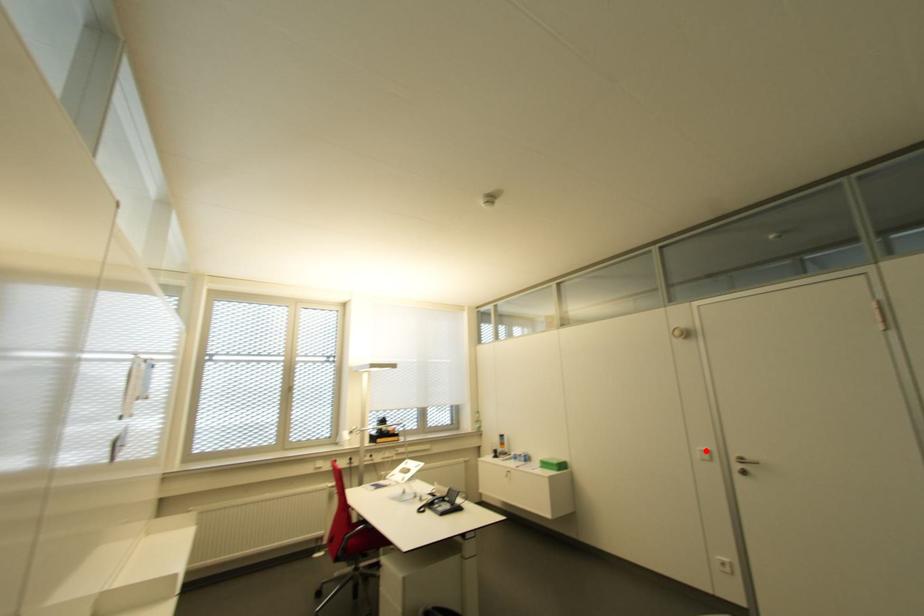
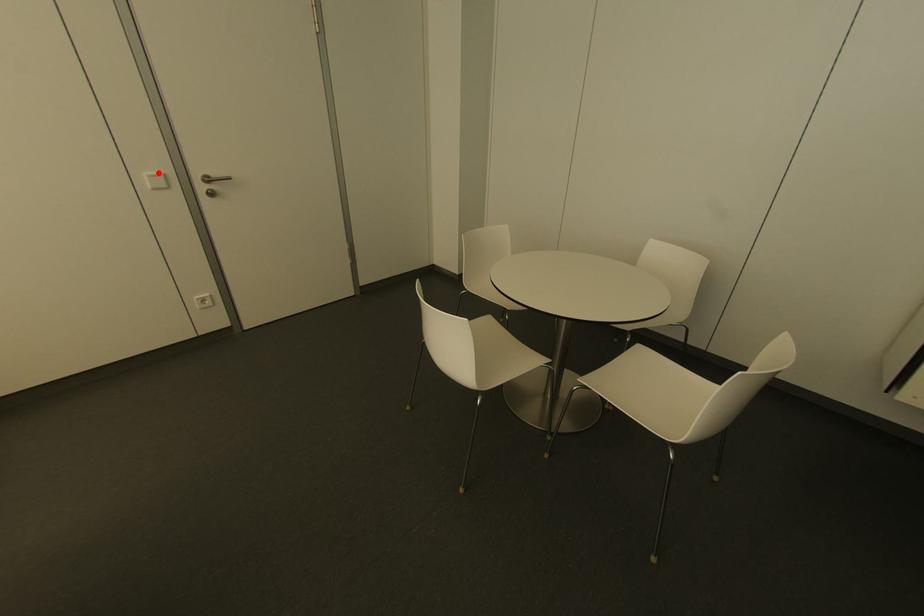
I am providing you with two images of the same scene from different viewpoints. A red point is marked on the first image and another point is marked on the second image. Are the points marked in image1 and image2 representing the same 3D position?

Yes